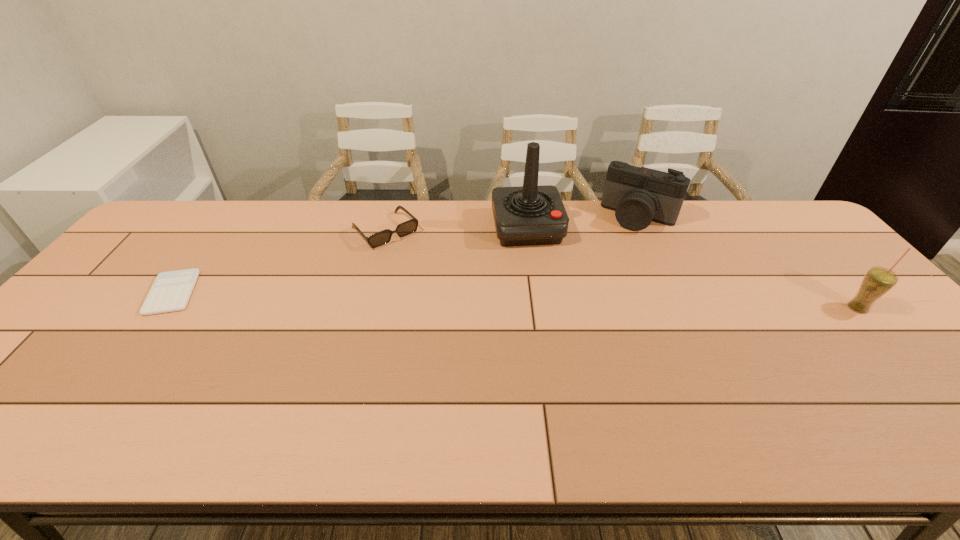
The width and height of the screenshot is (960, 540). I want to click on vacant spot on the desktop that is between the calculator and the rightmost object and is positioned on the front-facing side of the third object from right to left, so click(546, 301).

Find the location of a particular element. vacant spot on the desktop that is between the shortest object and the rightmost object and is positioned on the front-facing side of the sunglasses is located at coordinates (451, 299).

The width and height of the screenshot is (960, 540). What are the coordinates of `free space on the desktop that is between the shortest object and the straw for drinking and is positioned at the lens of the camera` in the screenshot? It's located at tap(596, 302).